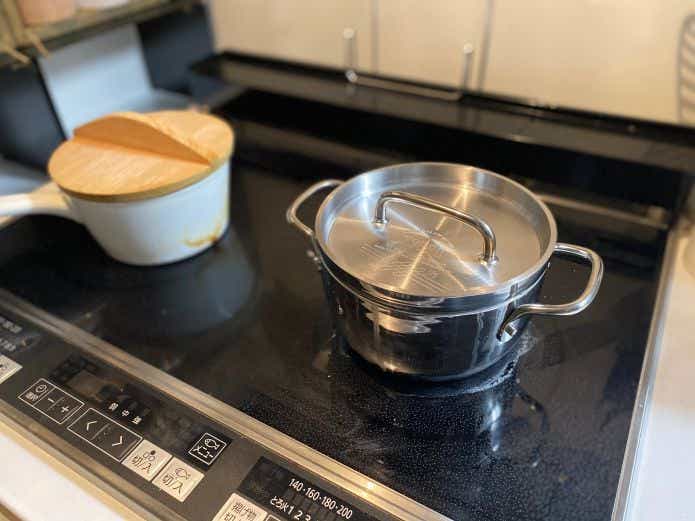
You are a GUI agent. You are given a task and a screenshot of the screen. Output one action in this format:
    pyautogui.click(x=<x>, y=<y>)
    Task: Click on the handles of the pot
    The width and height of the screenshot is (695, 521).
    Given the screenshot: What is the action you would take?
    pyautogui.click(x=584, y=301), pyautogui.click(x=297, y=204)